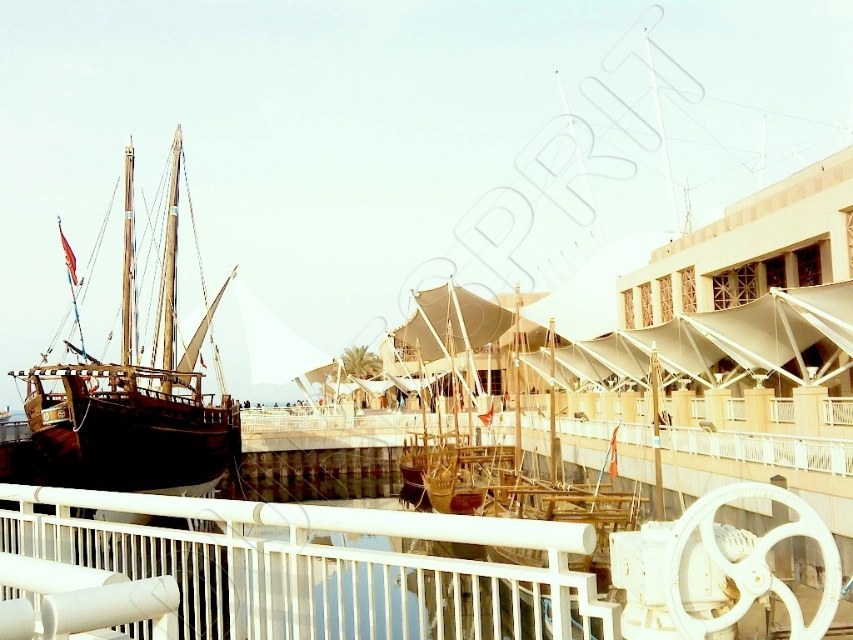
Is white metal fence at lower center to the right of wooden sailboat at left from the viewer's perspective?

Indeed, white metal fence at lower center is positioned on the right side of wooden sailboat at left.

Between point (180, 540) and point (161, 372), which one is positioned behind?

The point (161, 372) is behind.

Describe the element at coordinates (318, 566) in the screenshot. I see `white metal fence at lower center` at that location.

Where is `white metal fence at lower center`? Image resolution: width=853 pixels, height=640 pixels. white metal fence at lower center is located at coordinates (318, 566).

Find the location of a particular element. The width and height of the screenshot is (853, 640). white metal fence at lower center is located at coordinates (318, 566).

The height and width of the screenshot is (640, 853). What do you see at coordinates (318, 566) in the screenshot? I see `white metal fence at lower center` at bounding box center [318, 566].

The image size is (853, 640). Find the location of `white metal fence at lower center`. white metal fence at lower center is located at coordinates (318, 566).

Can you confirm if wooden sailboat at left is shorter than wooden sailboat at center?

No, wooden sailboat at left is not shorter than wooden sailboat at center.

Which is behind, point (167, 444) or point (450, 308)?

The point (450, 308) is behind.

The width and height of the screenshot is (853, 640). What are the coordinates of `wooden sailboat at left` in the screenshot? It's located at (128, 400).